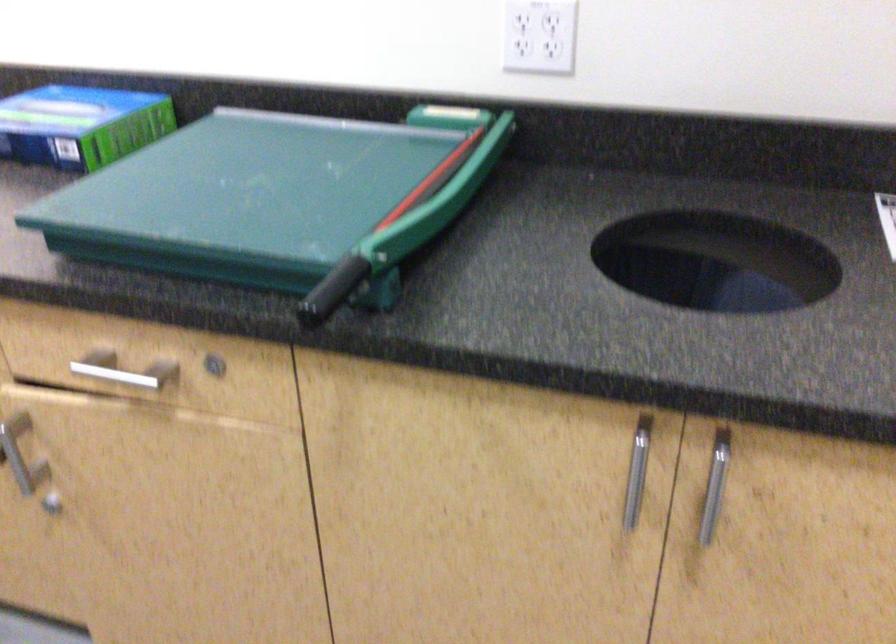
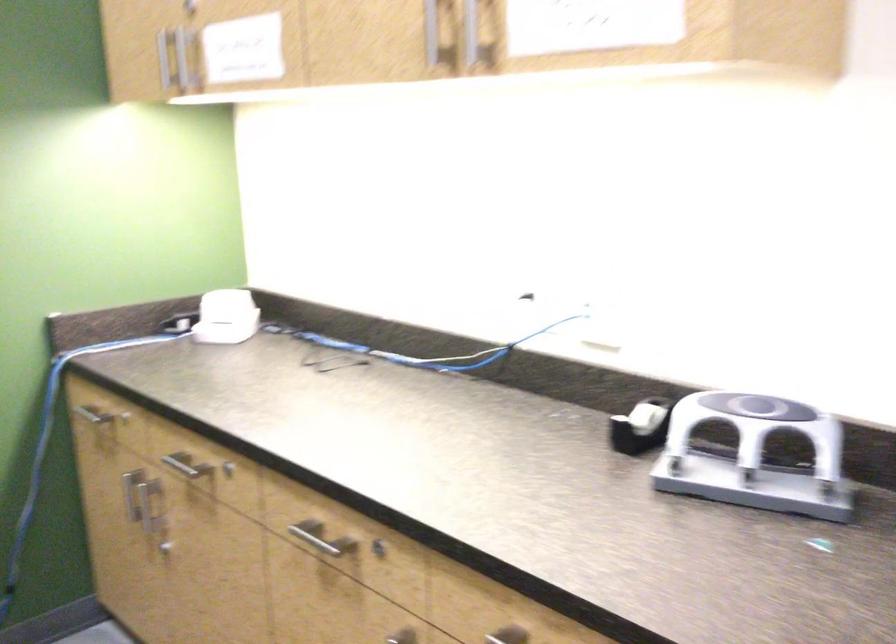
Question: The camera is either moving clockwise (left) or counter-clockwise (right) around the object. The first image is from the beginning of the video and the second image is from the end. Is the camera moving left or right when shooting the video?

Choices:
 (A) Left
 (B) Right

Answer: (B)